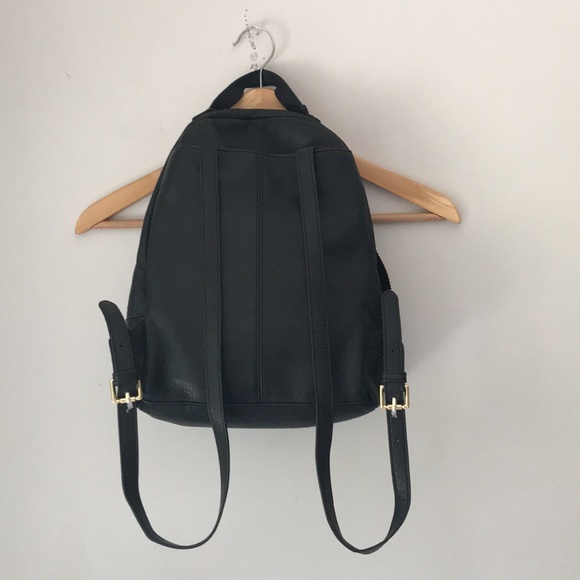
Locate an element on the screen. The image size is (580, 580). wall peg is located at coordinates (250, 37).